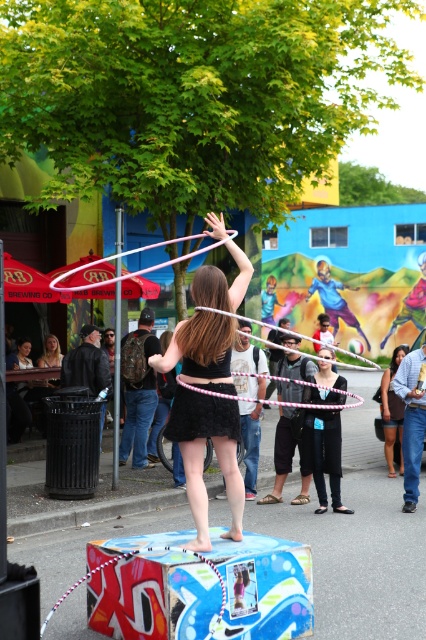
Measure the distance between point (339, 424) and camera.

The distance of point (339, 424) from camera is 33.10 feet.

Does black matte dress at center appear over matte black dress at center?

No.

Does point (345, 396) lie in front of point (394, 432)?

Yes, it is in front of point (394, 432).

Locate an element on the screen. Image resolution: width=426 pixels, height=640 pixels. black matte dress at center is located at coordinates (325, 454).

Who is more forward, (124, 346) or (322, 364)?

Positioned in front is point (322, 364).

Which is above, matte black backpack at center or black matte dress at center?

Positioned higher is matte black backpack at center.

Who is more forward, (x=137, y=452) or (x=336, y=483)?

Positioned in front is point (x=336, y=483).

Find the location of a particular element. The image size is (426, 640). matte black backpack at center is located at coordinates (138, 388).

Does point (150, 404) lie in front of point (386, 403)?

Yes, point (150, 404) is in front of point (386, 403).

Who is more distant from viewer, (149, 396) or (402, 424)?

Point (402, 424)

The image size is (426, 640). Find the location of `matte black backpack at center`. matte black backpack at center is located at coordinates (138, 388).